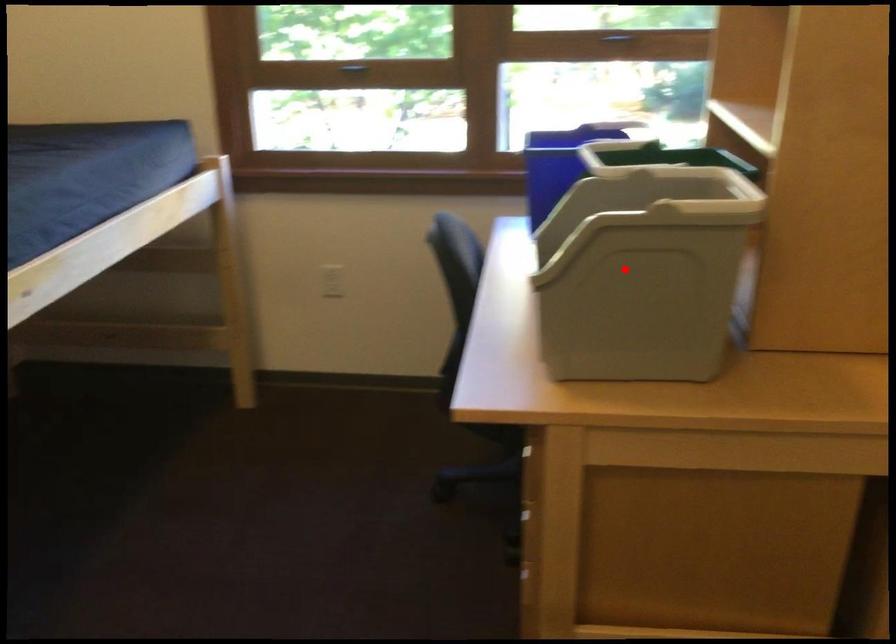
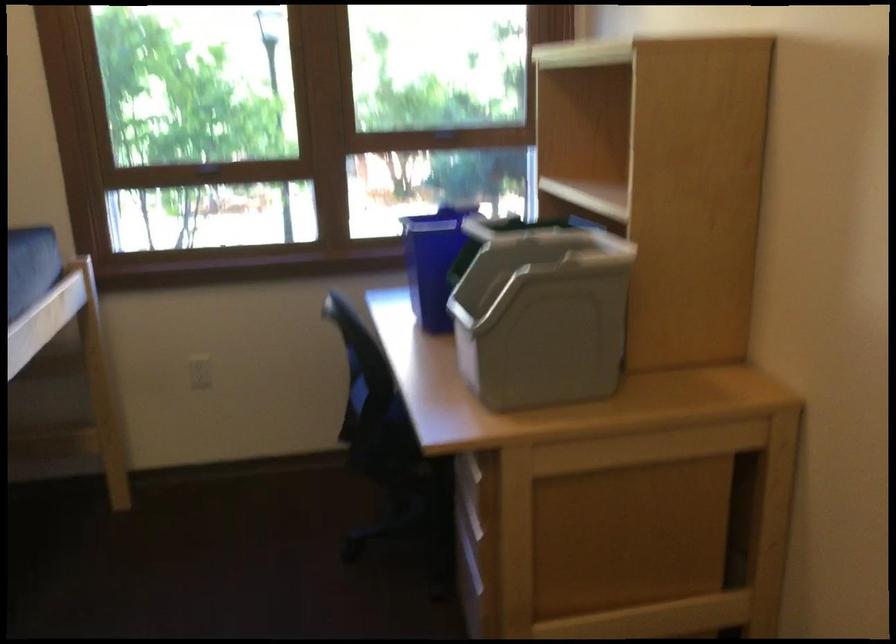
Question: I am providing you with two images of the same scene from different viewpoints. Image1 has a red point marked. In image2, the corresponding 3D location appears at what relative position? Reply with the corresponding letter.

Choices:
 (A) Closer
 (B) Farther

Answer: (B)